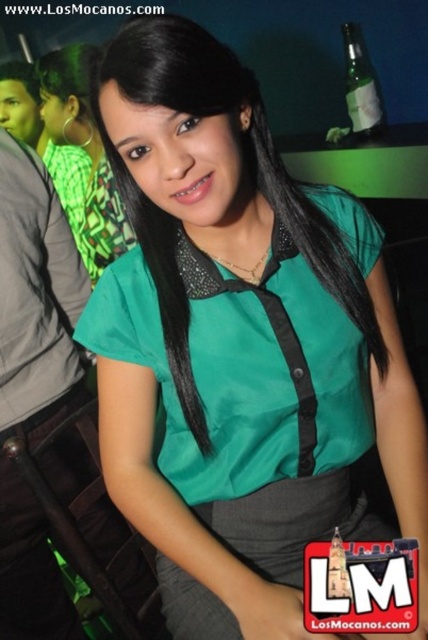
Question: Does green satin blouse at center have a smaller size compared to green glass bottle at upper right?

Choices:
 (A) yes
 (B) no

Answer: (B)

Question: Can you confirm if green satin blouse at center is smaller than green glass bottle at upper right?

Choices:
 (A) yes
 (B) no

Answer: (B)

Question: Which point is farther to the camera?

Choices:
 (A) tap(362, 56)
 (B) tap(92, 275)

Answer: (B)

Question: Among these objects, which one is farthest from the camera?

Choices:
 (A) green glass bottle at upper right
 (B) green satin blouse at center

Answer: (A)

Question: Is green satin blouse at center to the right of green glass bottle at upper right from the viewer's perspective?

Choices:
 (A) yes
 (B) no

Answer: (B)